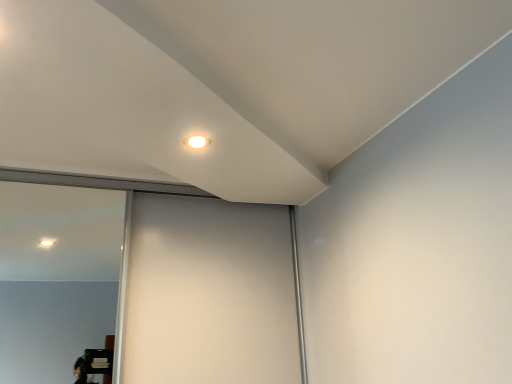
I want to click on white glossy light at upper center, so click(197, 142).

Measure the distance between point (192, 136) and camera.

Point (192, 136) and camera are 4.89 feet apart.

In order to face white glossy light at upper center, should I rotate leftwards or rightwards?

You should look left and rotate roughly 7.600 degrees.

The width and height of the screenshot is (512, 384). What do you see at coordinates (197, 142) in the screenshot? I see `white glossy light at upper center` at bounding box center [197, 142].

Find the location of `white glossy light at upper center`. white glossy light at upper center is located at coordinates (197, 142).